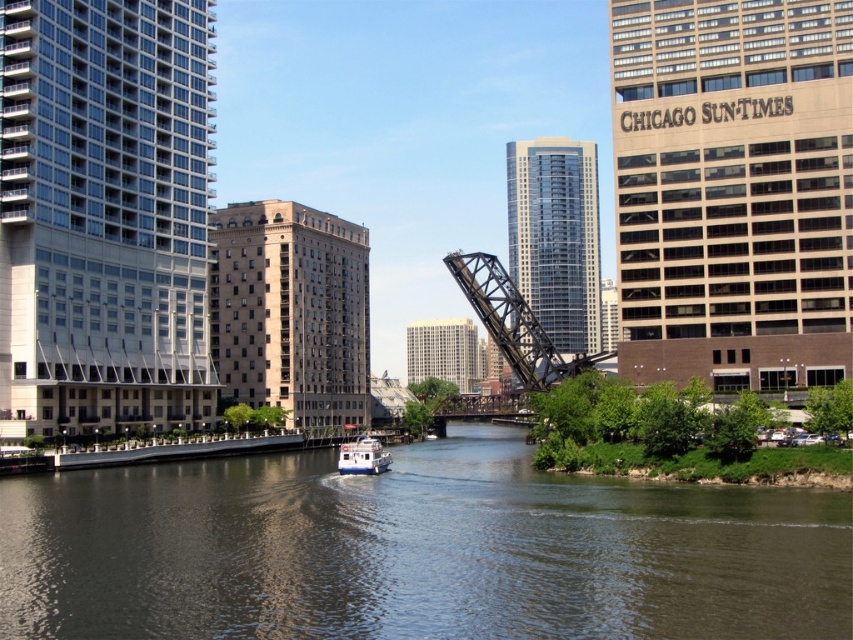
Question: Can you confirm if dark gray water at center is wider than white matte boat at center?

Choices:
 (A) no
 (B) yes

Answer: (B)

Question: Is dark gray water at center positioned before white matte boat at center?

Choices:
 (A) no
 (B) yes

Answer: (B)

Question: Which of the following is the farthest from the observer?

Choices:
 (A) white matte boat at center
 (B) dark gray water at center

Answer: (A)

Question: Can you confirm if dark gray water at center is positioned to the right of white matte boat at center?

Choices:
 (A) yes
 (B) no

Answer: (A)